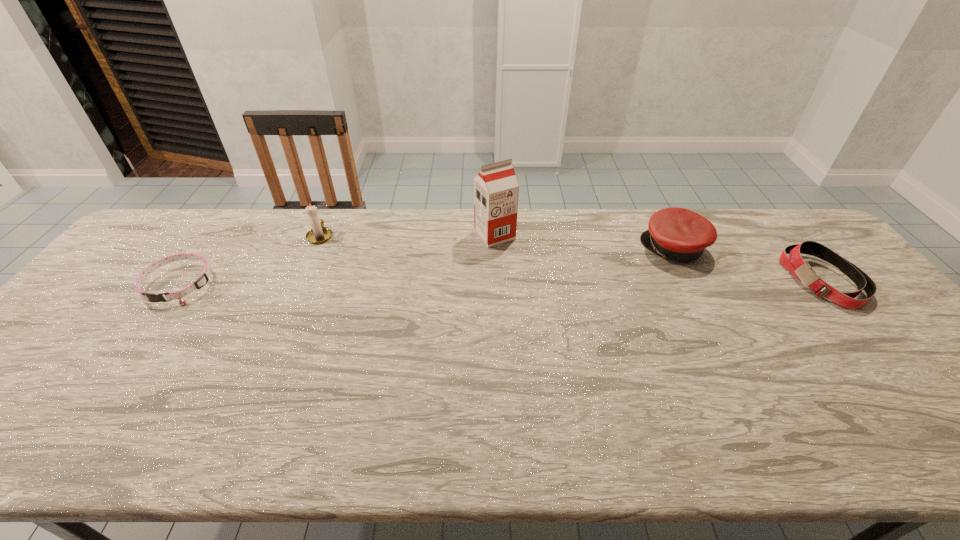
Locate an element on the screen. The height and width of the screenshot is (540, 960). soya milk is located at coordinates (496, 190).

Locate an element on the screen. The height and width of the screenshot is (540, 960). the tallest object is located at coordinates (496, 190).

Locate an element on the screen. The image size is (960, 540). the second tallest object is located at coordinates (319, 234).

Locate an element on the screen. candle holder is located at coordinates (319, 234).

The image size is (960, 540). I want to click on cap, so click(679, 234).

Find the location of a particular element. the third shortest object is located at coordinates (679, 234).

Identify the location of the right dog collar. The image size is (960, 540). (794, 263).

At what (x,y) coordinates should I click in order to perform the action: click on the fourth tallest object. Please return your answer as a coordinate pair (x, y). Looking at the image, I should click on (794, 263).

Find the location of a particular element. The height and width of the screenshot is (540, 960). the shortest object is located at coordinates (203, 278).

Where is `the shorter dog collar`? The image size is (960, 540). the shorter dog collar is located at coordinates (203, 278).